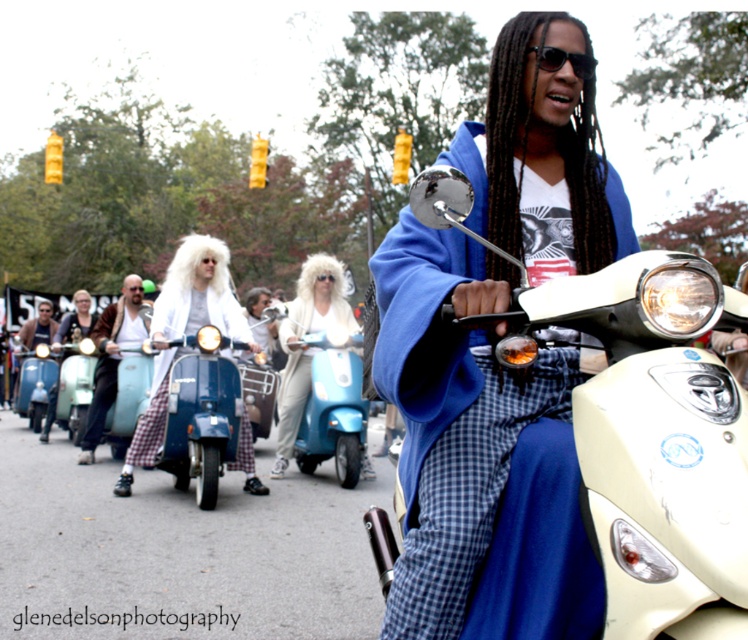
Question: Among these objects, which one is nearest to the camera?

Choices:
 (A) brown leather jacket at center
 (B) blue glossy scooter at center
 (C) blue fleece jacket at center
 (D) blue matte scooter at center

Answer: (C)

Question: Which point appears farthest from the camera in this image?

Choices:
 (A) (577, 64)
 (B) (12, 403)

Answer: (B)

Question: Is blue fleece jacket at center positioned at the back of brown leather jacket at center?

Choices:
 (A) no
 (B) yes

Answer: (A)

Question: Estimate the real-world distances between objects in this image. Which object is farther from the sunglasses at center?

Choices:
 (A) metallic blue scooter at center
 (B) blue glossy scooter at center

Answer: (A)

Question: In this image, where is blue glossy scooter at center located relative to matte blue scooter at center?

Choices:
 (A) left
 (B) right

Answer: (B)

Question: Does blue glossy scooter at center appear over matte blue scooter at center?

Choices:
 (A) yes
 (B) no

Answer: (A)